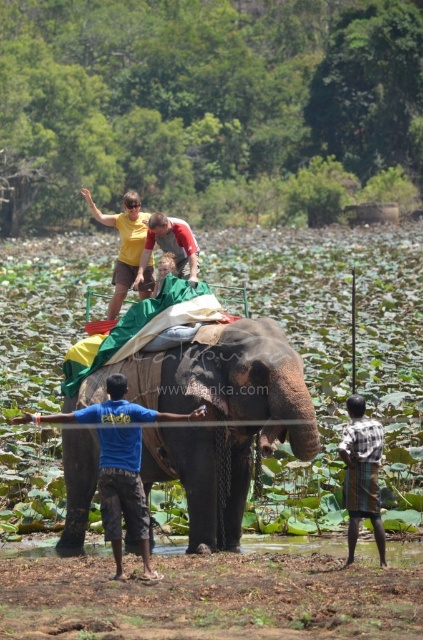
Question: Which of the following is the closest to the observer?

Choices:
 (A) brown textured elephant at center
 (B) plaid shirt at lower right
 (C) yellow fabric at center
 (D) blue cotton shirt at center

Answer: (A)

Question: Which point appears farthest from the camera in this image?

Choices:
 (A) (184, 241)
 (B) (241, 328)
 (C) (126, 220)
 (D) (101, 492)

Answer: (C)

Question: Which point is closer to the camera?

Choices:
 (A) yellow fabric at center
 (B) plaid shirt at lower right

Answer: (B)

Question: Is blue cotton shirt at center closer to camera compared to yellow fabric at center?

Choices:
 (A) no
 (B) yes

Answer: (B)

Question: Does yellow fabric at center have a smaller size compared to reddish-brown leather jacket at upper center?

Choices:
 (A) no
 (B) yes

Answer: (A)

Question: Is brown textured elephant at center smaller than plaid shirt at lower right?

Choices:
 (A) yes
 (B) no

Answer: (B)